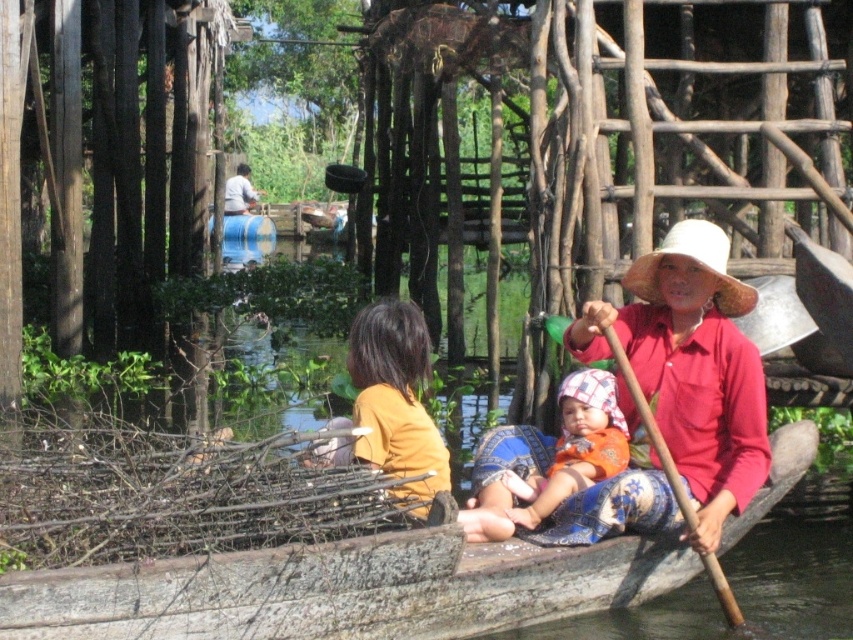
You are a tourist planning to take a photo of the wooden boat at center and the light blue fabric at upper center. Which object should you zoom in more on to capture both in the frame without cropping?

You should zoom in more on the wooden boat at center because it is smaller than the light blue fabric at upper center, ensuring both fit in the frame.

You are a traveler who needs to decide which item to take for a short trip. You can only choose between the orange cotton cloth at center and the brown wood paddle at center. Based on their sizes, which one is wider?

The orange cotton cloth at center is wider than the brown wood paddle at center, so you should choose the orange cotton cloth at center.